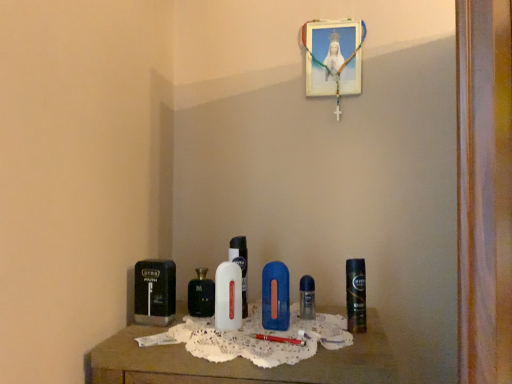
Locate an element on the screen. Image resolution: width=512 pixels, height=384 pixels. vacant area that is in front of matte black perfume at center, which appears as the first perfume when viewed from the back is located at coordinates (191, 333).